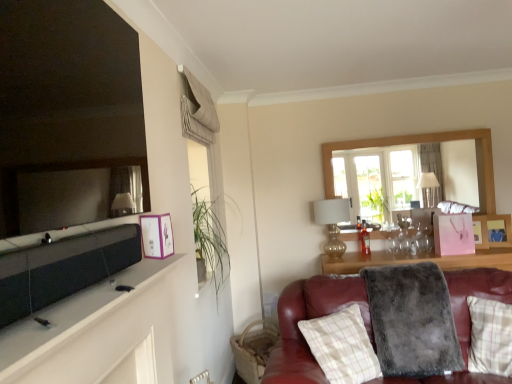
The height and width of the screenshot is (384, 512). What are the coordinates of `free point above matte black tv at upper left (from a real-world perspective)` in the screenshot? It's located at (73, 304).